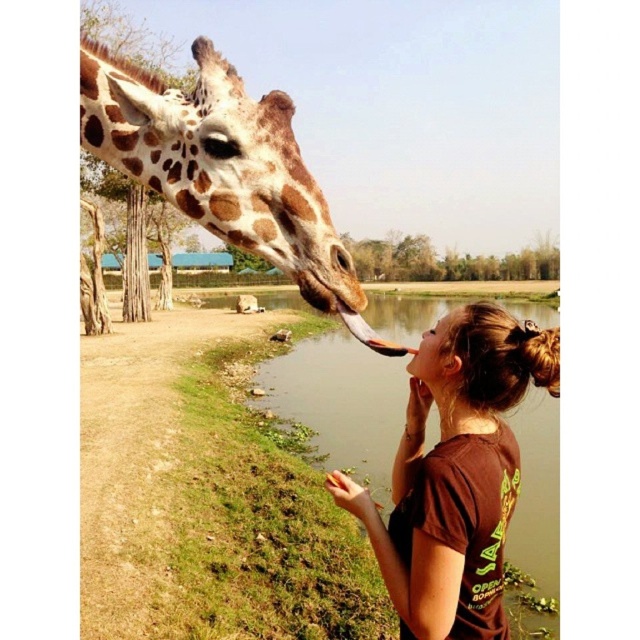
You are a photographer trying to capture a closeup of the brown matte shirt at center and the spotted fur giraffe at upper left. Which object appears wider in the photo?

The spotted fur giraffe at upper left appears wider in the photo since the brown matte shirt at center has a lesser width compared to it.

You are standing at the point labeled as point (456, 474) in the image. What object is located exactly at this point?

The point (456, 474) indicates the brown matte shirt at center.

You are observing the giraffe and the person from a distance. Which of the two points, point (492, 432) or point (310, 173), appears closer to you?

Point (310, 173) appears closer to you because it is less further to the camera than point (492, 432).